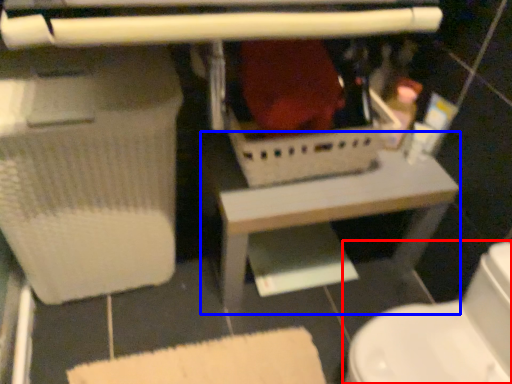
Question: Which of the following is the closest to the observer, toilet (highlighted by a red box) or table (highlighted by a blue box)?

Choices:
 (A) toilet
 (B) table

Answer: (A)